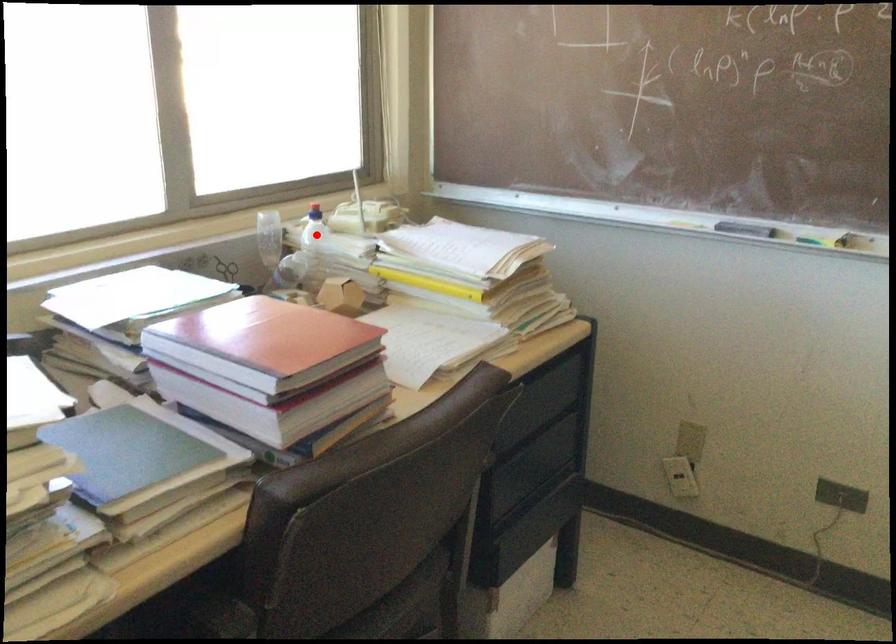
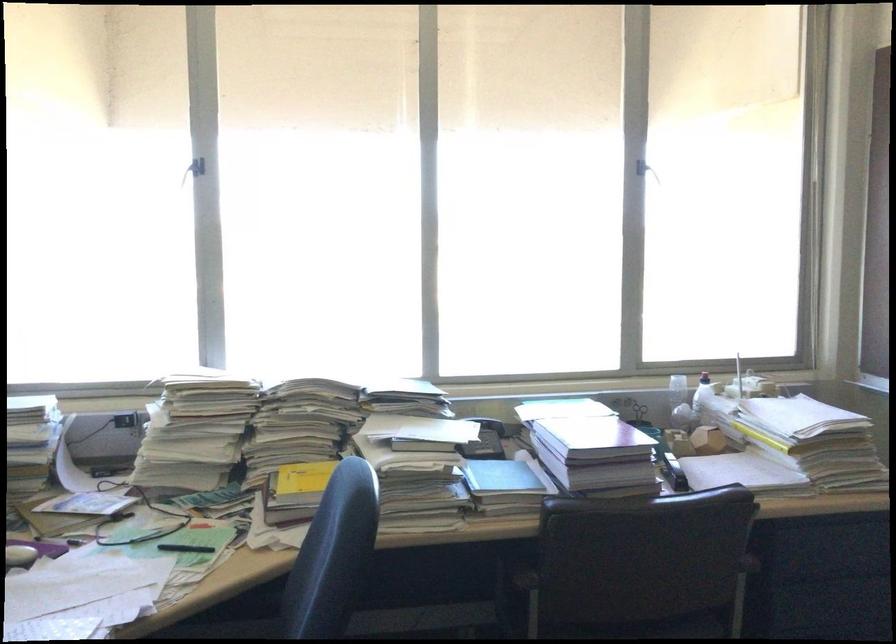
Where in the second image is the point corresponding to the highlighted location from the first image?

(702, 392)